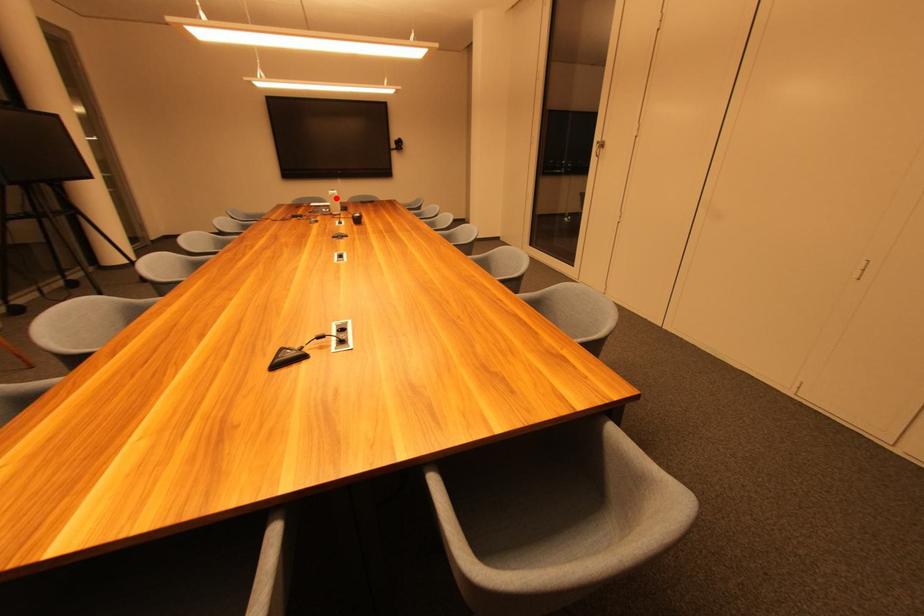
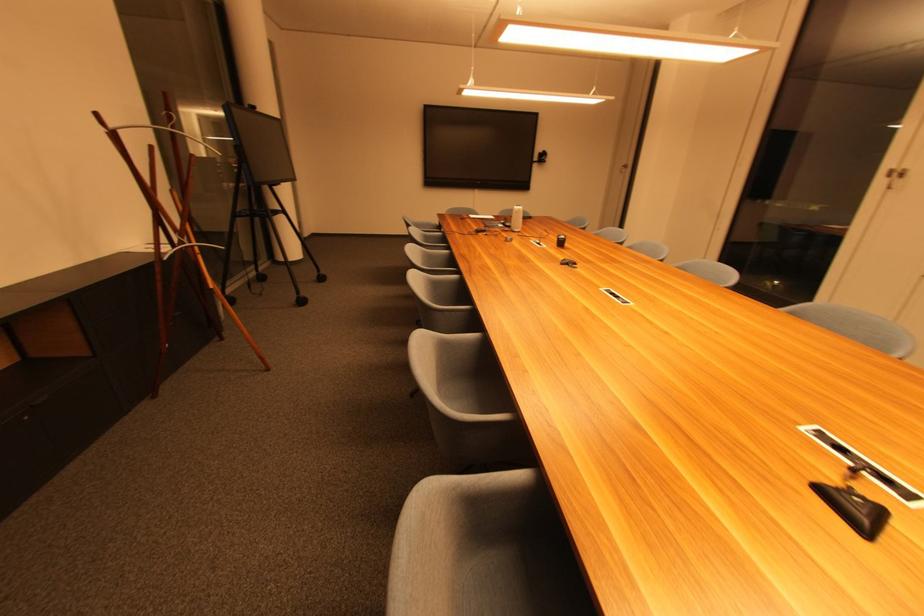
Find the pixel in the second image that matches the highlighted location in the first image.

(521, 214)